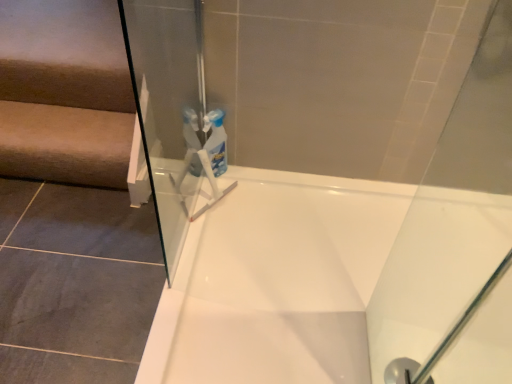
In order to click on space that is in front of beige fabric stairwell at left in this screenshot , I will do `click(57, 239)`.